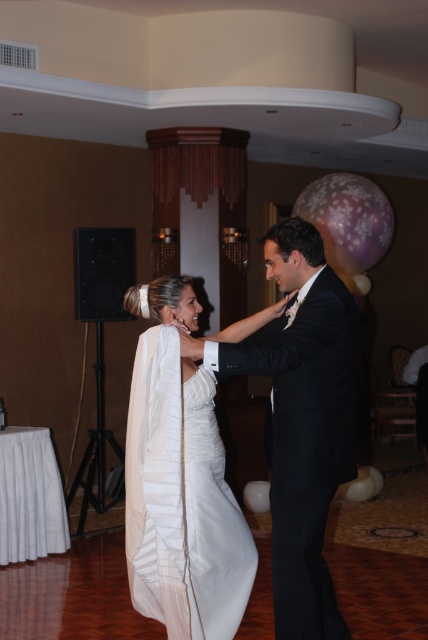
Does point (294, 396) come farther from viewer compared to point (193, 465)?

No, (294, 396) is in front of (193, 465).

Looking at this image, is black satin suit at center shorter than satin white dress at center?

Incorrect, black satin suit at center's height does not fall short of satin white dress at center's.

Locate an element on the screen. Image resolution: width=428 pixels, height=640 pixels. black satin suit at center is located at coordinates (302, 420).